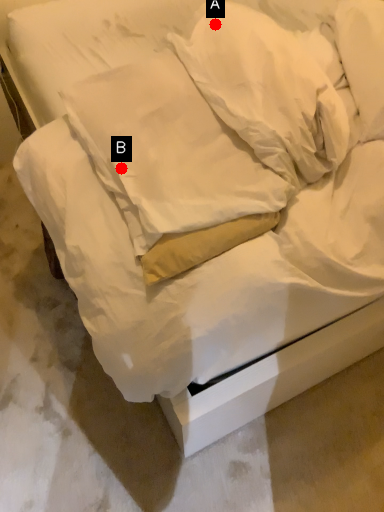
Question: Two points are circled on the image, labeled by A and B beside each circle. Which point appears closest to the camera in this image?

Choices:
 (A) A is closer
 (B) B is closer

Answer: (B)